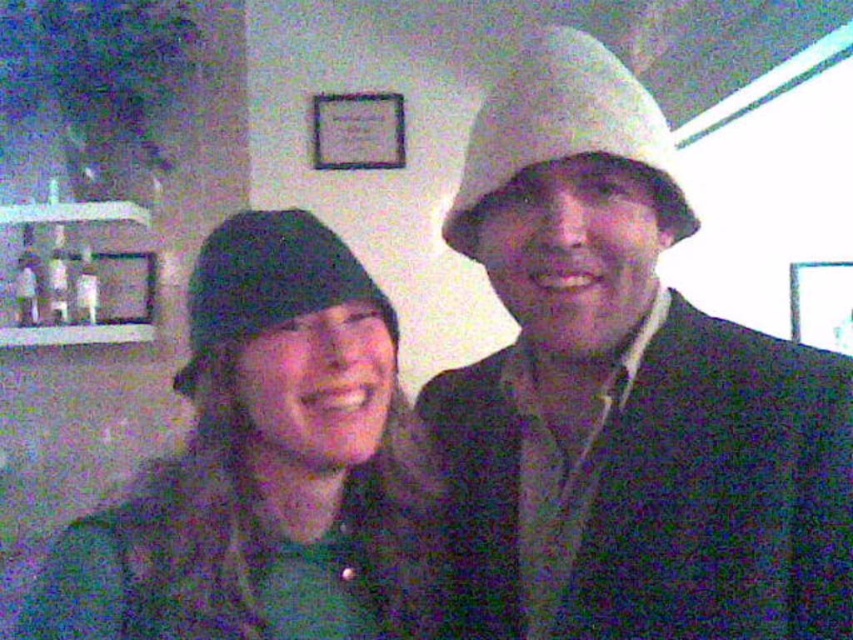
Does white matte hat at upper right come in front of black knit hat at left?

Yes.

Does white matte hat at upper right have a lesser width compared to black knit hat at left?

No.

Is point (578, 36) less distant than point (228, 273)?

Yes, it is.

Locate an element on the screen. white matte hat at upper right is located at coordinates (563, 125).

Is point (184, 472) positioned behind point (312, 268)?

Yes, point (184, 472) is behind point (312, 268).

Identify the location of black knit beanie at left. (265, 467).

Between black knit beanie at left and white matte hat at upper right, which one is positioned lower?

black knit beanie at left is below.

Is black knit beanie at left shorter than white matte hat at upper right?

In fact, black knit beanie at left may be taller than white matte hat at upper right.

Between point (223, 296) and point (627, 72), which one is positioned behind?

The point (627, 72) is behind.

Image resolution: width=853 pixels, height=640 pixels. Identify the location of black knit beanie at left. (265, 467).